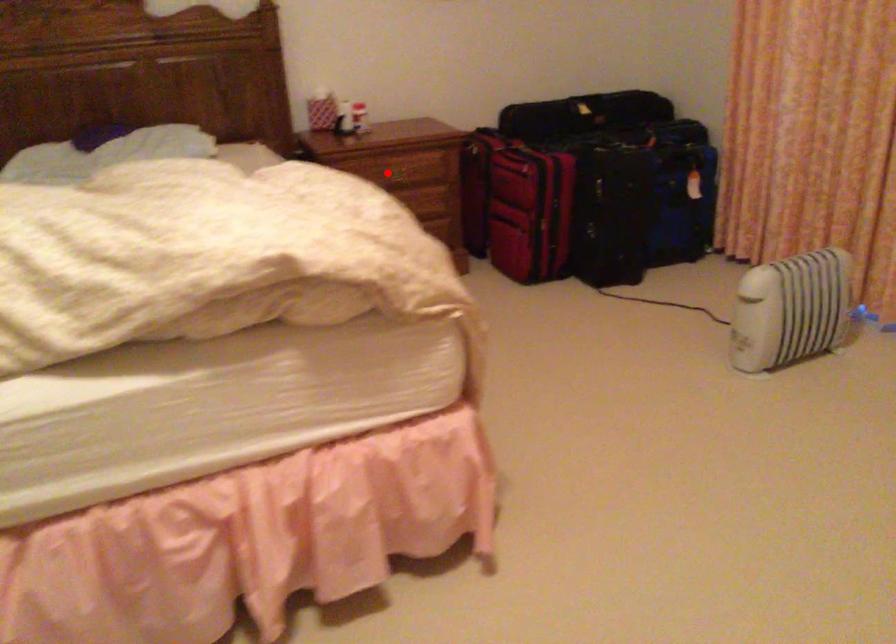
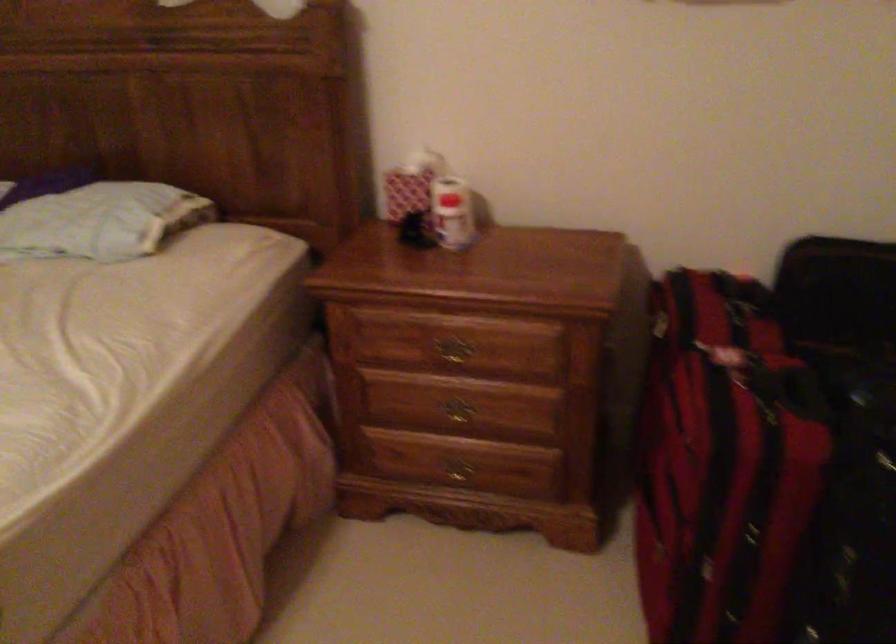
Where in the second image is the point corresponding to the highlighted location from the first image?

(452, 353)